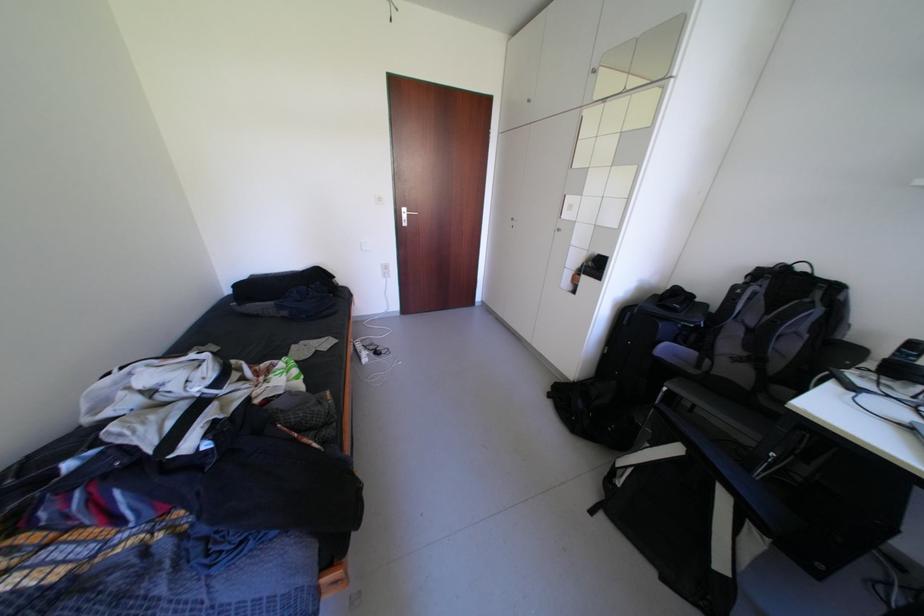
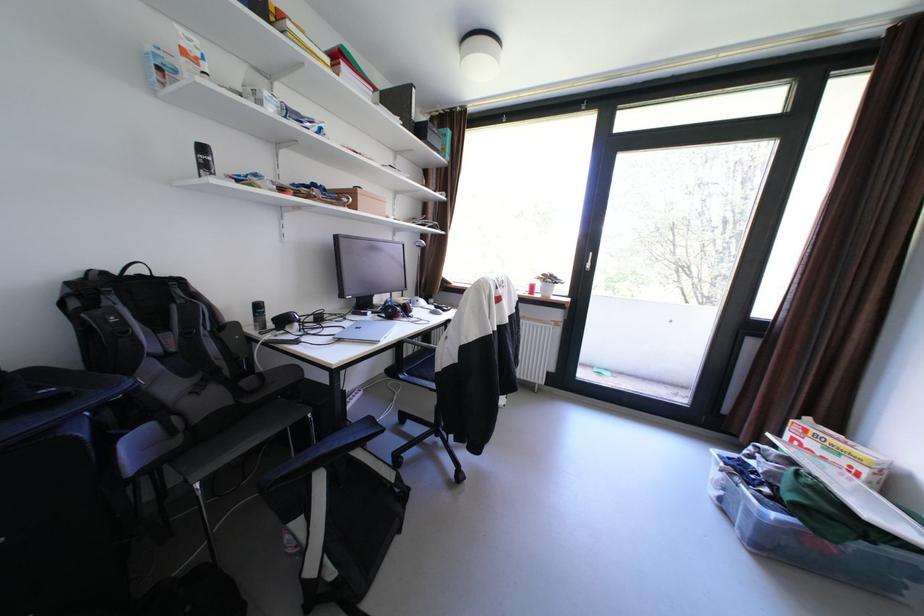
Find the pixel in the second image that matches point 735,471 in the first image.

(361, 440)